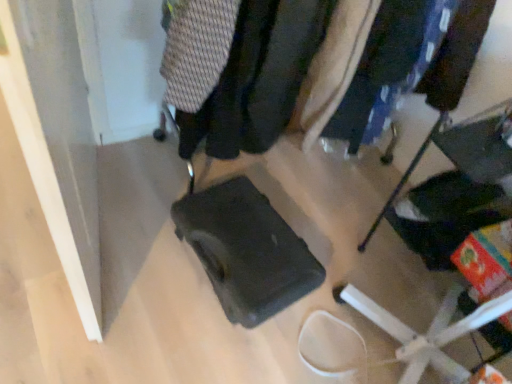
Question: From the image's perspective, does knitted fabric sweater at upper center, which is the 1th clothing in left-to-right order, appear lower than matte black suitcase at center?

Choices:
 (A) no
 (B) yes

Answer: (A)

Question: Is knitted fabric sweater at upper center, the second clothing positioned from the right, wider than matte black suitcase at center?

Choices:
 (A) no
 (B) yes

Answer: (B)

Question: Is knitted fabric sweater at upper center, which is the 1th clothing in left-to-right order, bigger than matte black suitcase at center?

Choices:
 (A) yes
 (B) no

Answer: (A)

Question: Is knitted fabric sweater at upper center, the second clothing positioned from the right, surrounding matte black suitcase at center?

Choices:
 (A) yes
 (B) no

Answer: (B)

Question: Is knitted fabric sweater at upper center, the second clothing positioned from the right, oriented towards matte black suitcase at center?

Choices:
 (A) no
 (B) yes

Answer: (A)

Question: Can you confirm if knitted fabric sweater at upper center, which is the 1th clothing in left-to-right order, is smaller than matte black suitcase at center?

Choices:
 (A) no
 (B) yes

Answer: (A)

Question: From the image's perspective, is knitted fabric sweater at upper center, which is the 1th clothing in left-to-right order, on top of matte black suitcase at center?

Choices:
 (A) yes
 (B) no

Answer: (A)

Question: Is knitted fabric sweater at upper center, which is the 1th clothing in left-to-right order, beside matte black suitcase at center?

Choices:
 (A) no
 (B) yes

Answer: (A)

Question: Considering the relative sizes of knitted fabric sweater at upper center, the second clothing positioned from the right, and matte black suitcase at center in the image provided, is knitted fabric sweater at upper center, the second clothing positioned from the right, shorter than matte black suitcase at center?

Choices:
 (A) no
 (B) yes

Answer: (B)

Question: Is knitted fabric sweater at upper center, which is the 1th clothing in left-to-right order, aimed at matte black suitcase at center?

Choices:
 (A) no
 (B) yes

Answer: (A)

Question: Does knitted fabric sweater at upper center, which is the 1th clothing in left-to-right order, come in front of matte black suitcase at center?

Choices:
 (A) no
 (B) yes

Answer: (A)

Question: Is there a large distance between knitted fabric sweater at upper center, the second clothing positioned from the right, and matte black suitcase at center?

Choices:
 (A) yes
 (B) no

Answer: (B)

Question: Considering the relative positions of matte black suitcase at center and knitted fabric sweater at upper center, which is the 1th clothing in left-to-right order, in the image provided, is matte black suitcase at center to the right of knitted fabric sweater at upper center, which is the 1th clothing in left-to-right order, from the viewer's perspective?

Choices:
 (A) no
 (B) yes

Answer: (B)